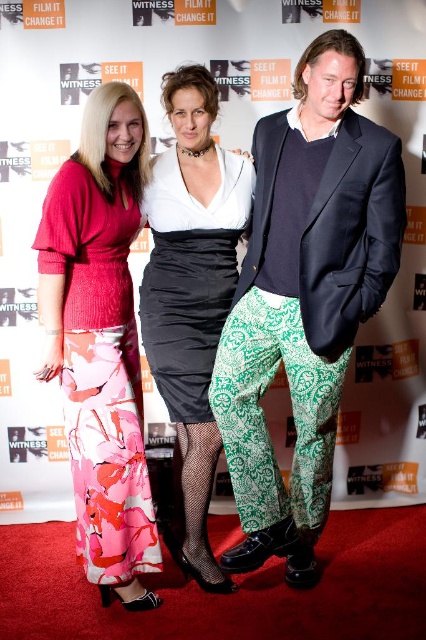
Question: Is green printed pants at center in front of floral fabric dress at left?

Choices:
 (A) no
 (B) yes

Answer: (B)

Question: Can you confirm if green printed pants at center is bigger than satin dress at center?

Choices:
 (A) yes
 (B) no

Answer: (A)

Question: Which point is closer to the camera taking this photo?

Choices:
 (A) (66, 282)
 (B) (336, 74)
 (C) (221, 176)

Answer: (B)

Question: Which object appears closest to the camera in this image?

Choices:
 (A) floral fabric dress at left
 (B) green printed pants at center

Answer: (B)

Question: Considering the real-world distances, which object is closest to the green printed pants at center?

Choices:
 (A) floral fabric dress at left
 (B) satin dress at center

Answer: (B)

Question: Does floral fabric dress at left have a smaller size compared to satin dress at center?

Choices:
 (A) no
 (B) yes

Answer: (A)